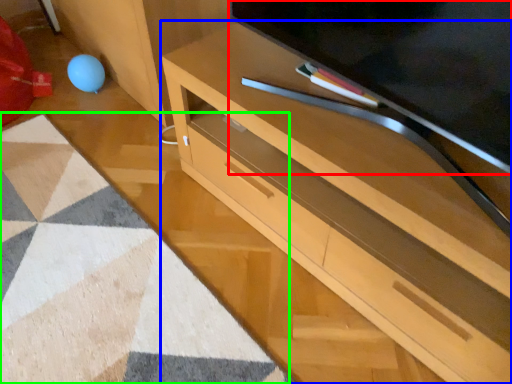
Question: Which object is positioned farthest from television (highlighted by a red box)? Select from desk (highlighted by a blue box) and mat (highlighted by a green box).

Choices:
 (A) desk
 (B) mat

Answer: (B)